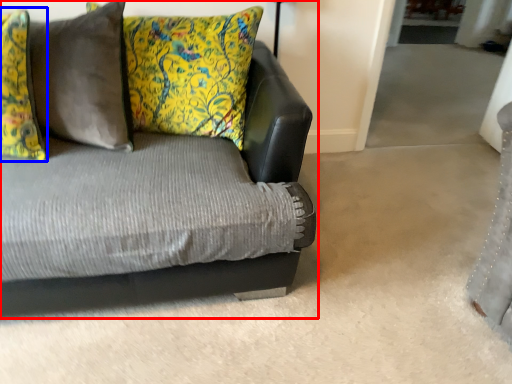
Question: Which object appears closest to the camera in this image, studio couch (highlighted by a red box) or pillow (highlighted by a blue box)?

Choices:
 (A) studio couch
 (B) pillow

Answer: (A)